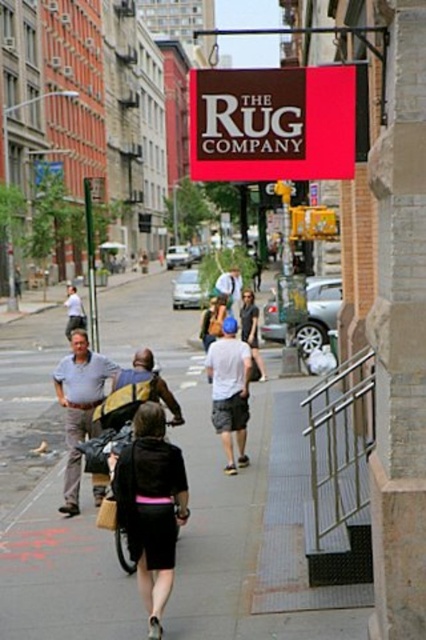
You are a photographer standing at the corner of the street. You want to take a picture of the light blue shirt at center so that it appears in the center of your photo. According to the coordinates provided, where should you aim your camera?

The light blue shirt at center is located at coordinates point (78, 406), so you should aim your camera at that point to center it in your photo.

You are a delivery person trying to locate the address for a rug delivery. You see the matte brown sign at upper center and the black matte shorts at center. Which object is larger and can help you identify the building?

The matte brown sign at upper center is bigger than the black matte shorts at center, so the matte brown sign at upper center is larger and can help identify the building.